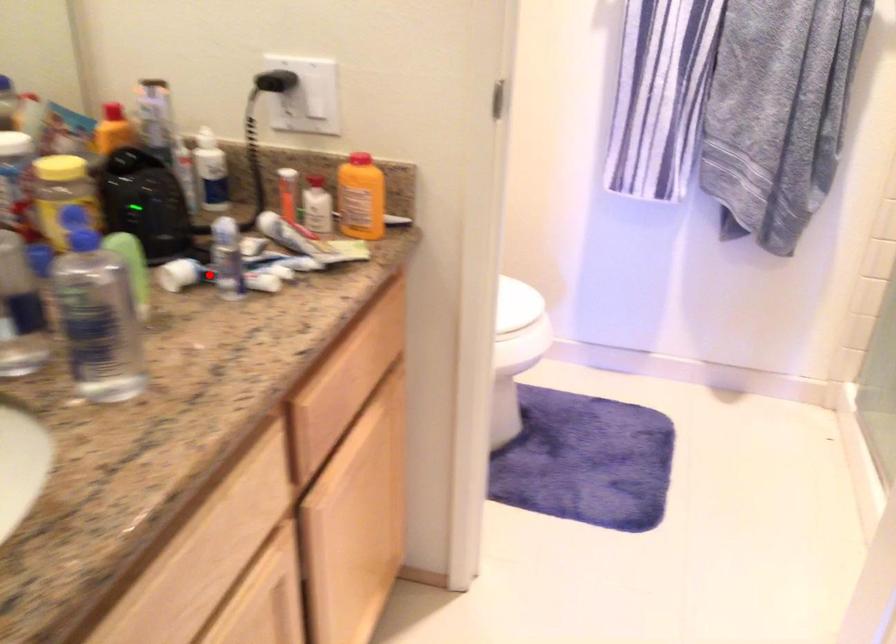
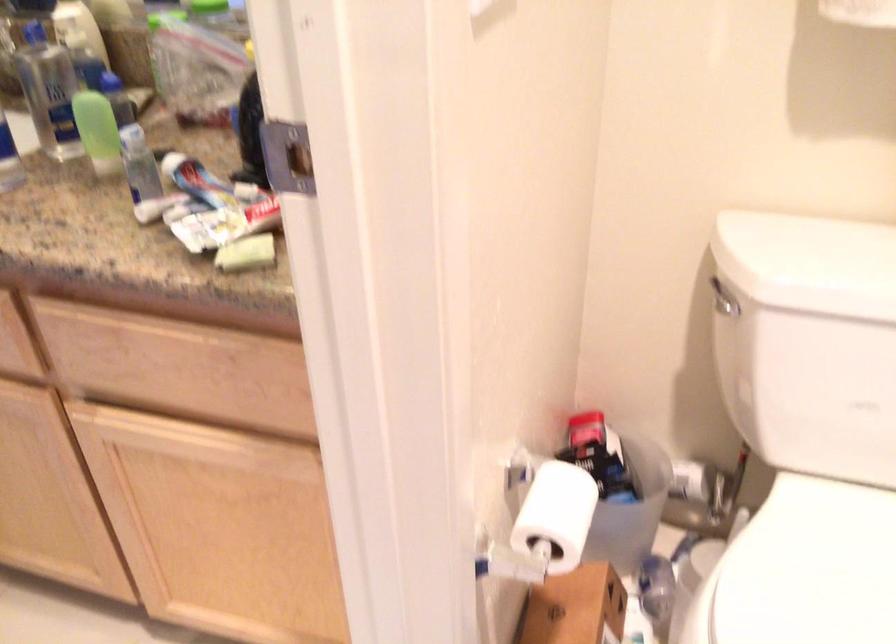
Locate, in the second image, the point that corresponds to the highlighted location in the first image.

(197, 182)